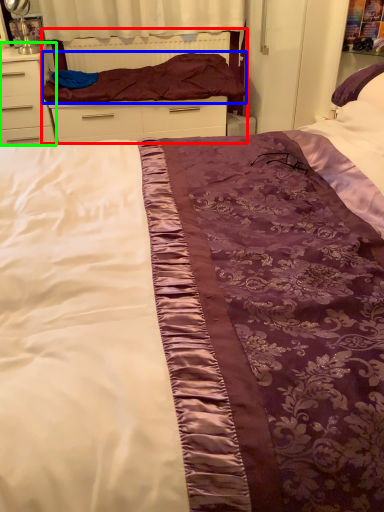
Question: Which object is positioned farthest from bed frame (highlighted by a red box)? Select from blanket (highlighted by a blue box) and chest of drawers (highlighted by a green box).

Choices:
 (A) blanket
 (B) chest of drawers

Answer: (B)